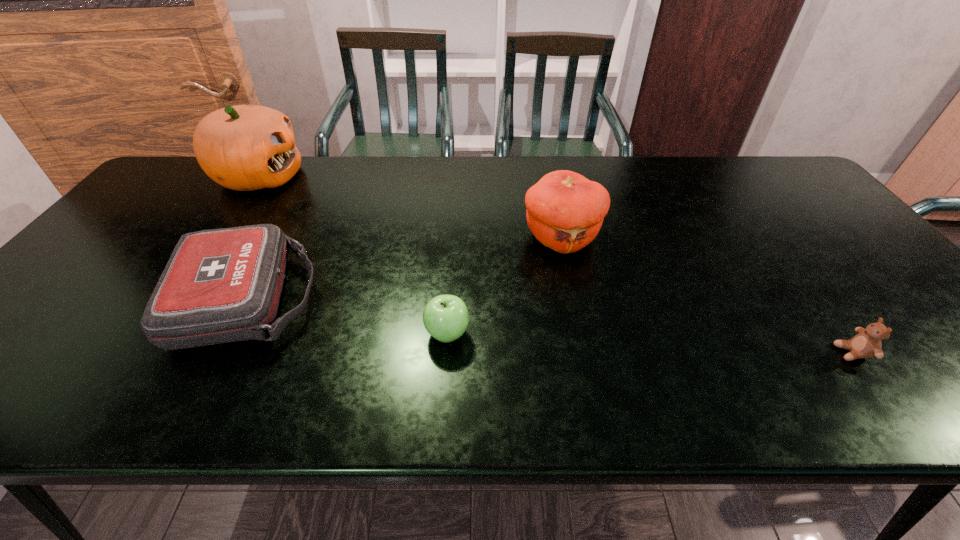
The width and height of the screenshot is (960, 540). Find the location of `vacant area that lies between the rightmost object and the third object from right to left`. vacant area that lies between the rightmost object and the third object from right to left is located at coordinates (650, 343).

At what (x,y) coordinates should I click in order to perform the action: click on vacant space in between the right pumpkin and the first-aid kit. Please return your answer as a coordinate pair (x, y). Looking at the image, I should click on (403, 268).

The height and width of the screenshot is (540, 960). In order to click on unoccupied position between the third object from left to right and the rightmost object in this screenshot , I will do `click(650, 343)`.

At what (x,y) coordinates should I click in order to perform the action: click on vacant area that lies between the teddy bear and the left pumpkin. Please return your answer as a coordinate pair (x, y). The width and height of the screenshot is (960, 540). Looking at the image, I should click on (555, 265).

Identify the location of free space between the rightmost object and the taller pumpkin. This screenshot has width=960, height=540. (555, 265).

You are a GUI agent. You are given a task and a screenshot of the screen. Output one action in this format:
    pyautogui.click(x=<x>, y=<y>)
    Task: Click on the empty space between the teddy bear and the first-aid kit
    The width and height of the screenshot is (960, 540).
    Given the screenshot: What is the action you would take?
    pyautogui.click(x=548, y=326)

The height and width of the screenshot is (540, 960). I want to click on free spot between the nearer pumpkin and the rightmost object, so click(707, 295).

The width and height of the screenshot is (960, 540). Find the location of `object that is the fourth closest to the first-aid kit`. object that is the fourth closest to the first-aid kit is located at coordinates (867, 343).

Locate which object ranks third in proximity to the first-aid kit. Please provide its 2D coordinates. Your answer should be formatted as a tuple, i.e. [(x, y)], where the tuple contains the x and y coordinates of a point satisfying the conditions above.

[(565, 211)]

You are a GUI agent. You are given a task and a screenshot of the screen. Output one action in this format:
    pyautogui.click(x=<x>, y=<y>)
    Task: Click on the vacant space that satisfies the following two spatial constraints: 1. on the face of the first-aid kit; 2. on the left side of the farther pumpkin
    Image resolution: width=960 pixels, height=540 pixels.
    Given the screenshot: What is the action you would take?
    pyautogui.click(x=176, y=299)